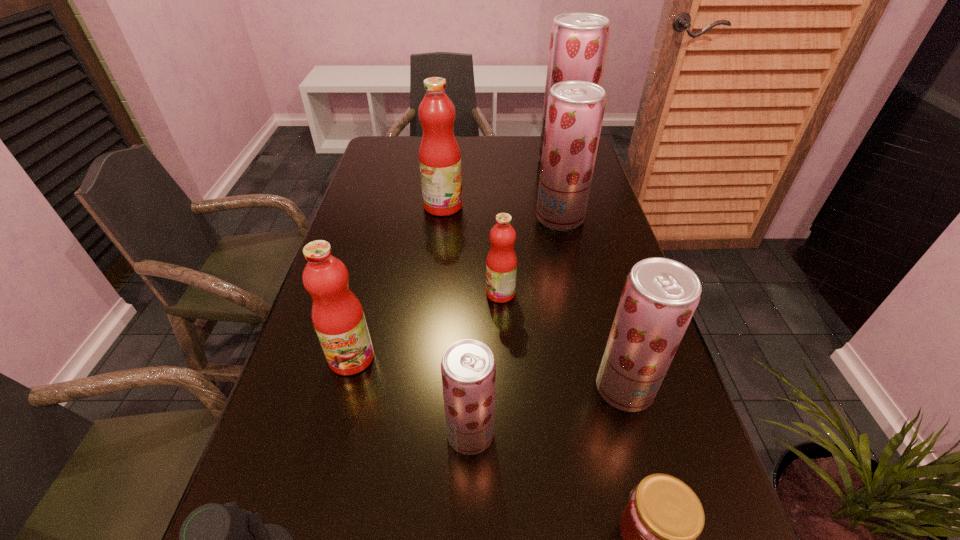
You are a GUI agent. You are given a task and a screenshot of the screen. Output one action in this format:
    pyautogui.click(x=<x>, y=<y>)
    Task: Click on the vacant area that lies between the third biggest strawberry fruit juice and the second biggest strawberry fruit juice
    
    Given the screenshot: What is the action you would take?
    pyautogui.click(x=592, y=303)

Locate an element on the screen. The height and width of the screenshot is (540, 960). free space between the second nearest pink fruit juice and the second smallest pink fruit juice is located at coordinates (426, 326).

I want to click on free spot between the third biggest strawberry fruit juice and the biggest pink fruit juice, so click(534, 297).

Locate an element on the screen. This screenshot has width=960, height=540. object identified as the closest to the leftmost strawberry fruit juice is located at coordinates (338, 318).

Locate which object ranks fifth in proximity to the fourth nearest fruit juice. Please provide its 2D coordinates. Your answer should be formatted as a tuple, i.e. [(x, y)], where the tuple contains the x and y coordinates of a point satisfying the conditions above.

[(439, 154)]

The width and height of the screenshot is (960, 540). What are the coordinates of `fruit juice that is the seventh closest to the microphone` in the screenshot? It's located at (578, 42).

What are the coordinates of `the second closest fruit juice relative to the microphone` in the screenshot? It's located at (338, 318).

This screenshot has height=540, width=960. In order to click on strawberry fruit juice that is the closest one to the biggest pink fruit juice in this screenshot , I will do `click(575, 109)`.

Select which strawberry fruit juice appears as the second closest to the biggest pink fruit juice. Please provide its 2D coordinates. Your answer should be formatted as a tuple, i.e. [(x, y)], where the tuple contains the x and y coordinates of a point satisfying the conditions above.

[(578, 42)]

Find the location of a particular element. The height and width of the screenshot is (540, 960). the third closest pink fruit juice relative to the leftmost strawberry fruit juice is located at coordinates (439, 154).